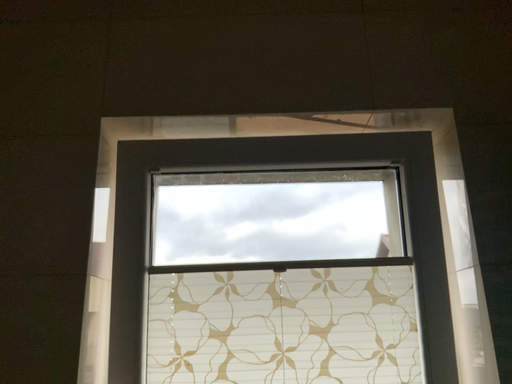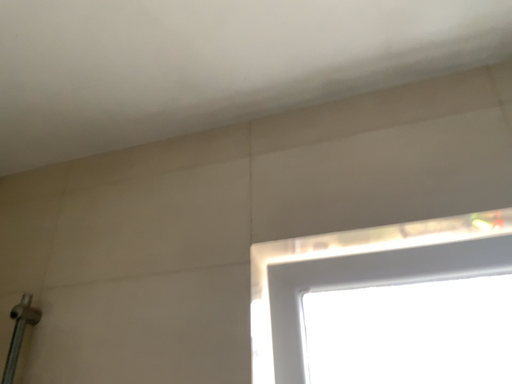
Question: Which way did the camera rotate in the video?

Choices:
 (A) rotated right
 (B) rotated left

Answer: (B)